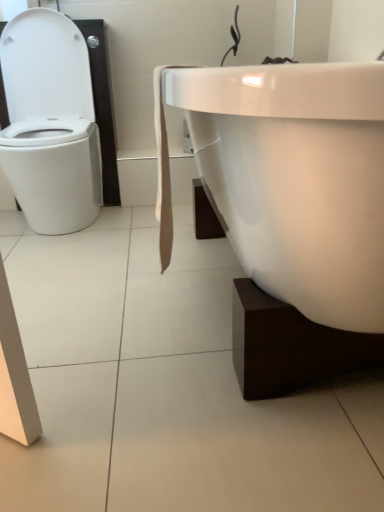
Question: Choose the correct answer: Is white glossy bathtub at right inside white glossy toilet at left or outside it?

Choices:
 (A) inside
 (B) outside

Answer: (B)

Question: Considering the positions of white glossy bathtub at right and white glossy toilet at left in the image, is white glossy bathtub at right taller or shorter than white glossy toilet at left?

Choices:
 (A) short
 (B) tall

Answer: (A)

Question: From a real-world perspective, is white glossy bathtub at right above or below white glossy toilet at left?

Choices:
 (A) below
 (B) above

Answer: (A)

Question: Is point (71, 226) closer or farther from the camera than point (218, 164)?

Choices:
 (A) closer
 (B) farther

Answer: (B)

Question: Is white glossy toilet at left situated inside white glossy bathtub at right or outside?

Choices:
 (A) outside
 (B) inside

Answer: (A)

Question: From the image's perspective, is white glossy toilet at left above or below white glossy bathtub at right?

Choices:
 (A) below
 (B) above

Answer: (B)

Question: Looking at their shapes, would you say white glossy toilet at left is wider or thinner than white glossy bathtub at right?

Choices:
 (A) thin
 (B) wide

Answer: (A)